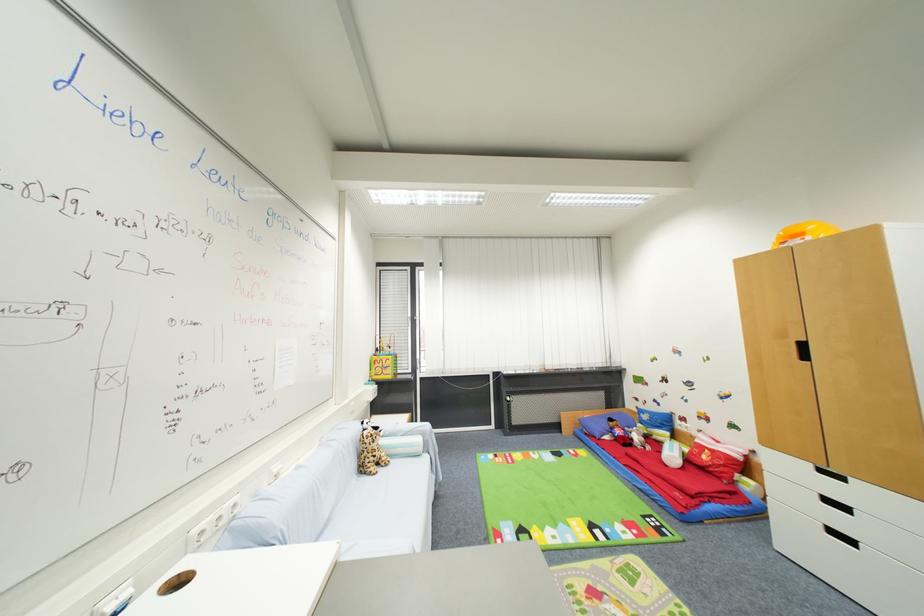
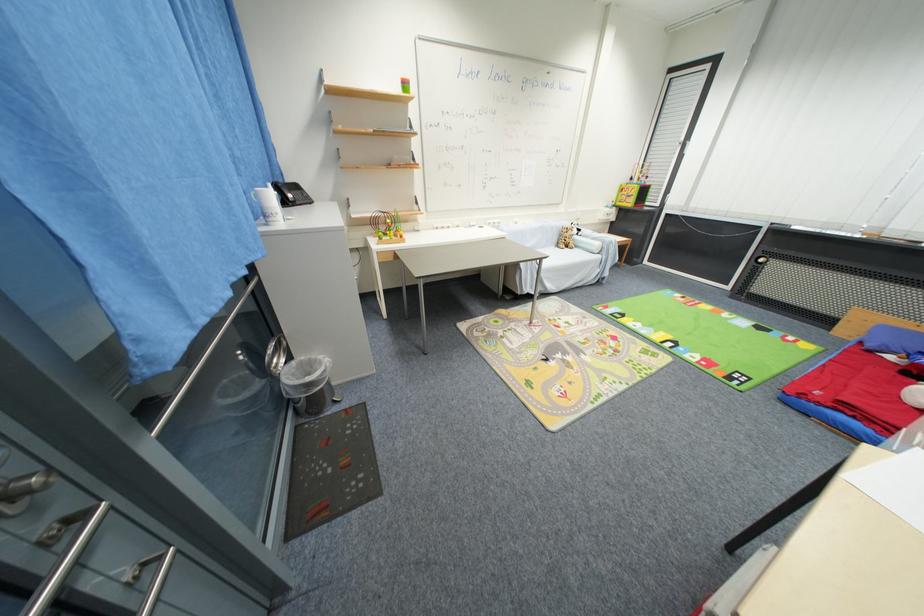
Find the pixel in the second image that matches [702,508] in the first image.

(824, 406)